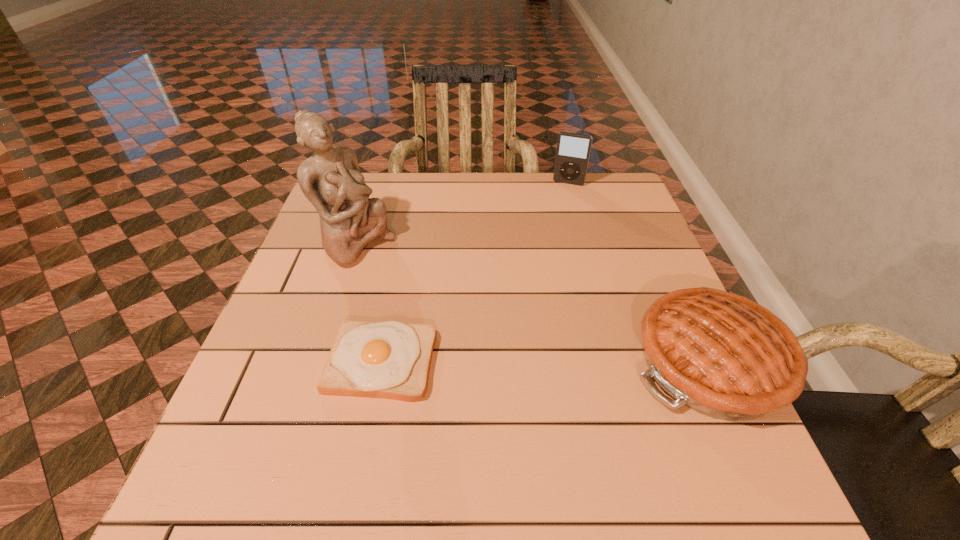
Image resolution: width=960 pixels, height=540 pixels. What are the coordinates of `iPod at the right edge` in the screenshot? It's located at (573, 150).

Locate an element on the screen. object that is at the near left corner is located at coordinates (391, 359).

Identify the location of object situated at the far right corner. This screenshot has height=540, width=960. (573, 150).

Identify the location of object at the near right corner. (721, 354).

Find the location of a particular element. vacant space at the far edge of the desktop is located at coordinates (557, 188).

In the image, there is a desktop. Identify the location of blank space at the near edge. This screenshot has height=540, width=960. (x=529, y=429).

What are the coordinates of `blank space at the left edge` in the screenshot? It's located at (284, 392).

Image resolution: width=960 pixels, height=540 pixels. What are the coordinates of `vacant area at the right edge` in the screenshot? It's located at (633, 378).

In the image, there is a desktop. Identify the location of free region at the far left corner. (388, 173).

In the image, there is a desktop. Where is `free region at the far right corner`? Image resolution: width=960 pixels, height=540 pixels. free region at the far right corner is located at coordinates (605, 187).